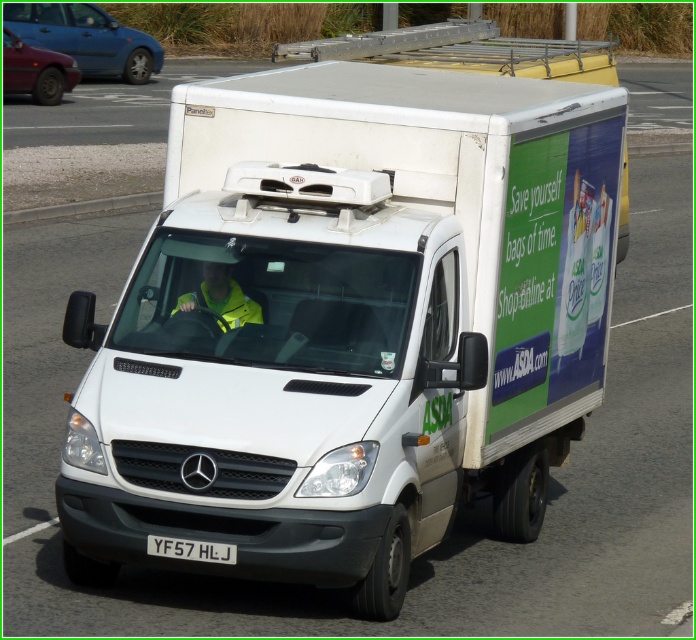
Can you confirm if metallic blue sedan at left is positioned to the right of yellow reflective jacket at center?

No, metallic blue sedan at left is not to the right of yellow reflective jacket at center.

Is point (40, 97) closer to viewer compared to point (258, 310)?

No.

Find the location of a particular element. The image size is (696, 640). metallic blue sedan at left is located at coordinates (35, 70).

Does blue metallic car at left have a greater width compared to yellow reflective jacket at center?

Yes, blue metallic car at left is wider than yellow reflective jacket at center.

Can you confirm if blue metallic car at left is thinner than yellow reflective jacket at center?

Incorrect, blue metallic car at left's width is not less than yellow reflective jacket at center's.

Where is `blue metallic car at left`? This screenshot has width=696, height=640. blue metallic car at left is located at coordinates (87, 38).

I want to click on blue metallic car at left, so click(x=87, y=38).

Can you confirm if metallic blue sedan at left is positioned above white plastic license plate at lower center?

Indeed, metallic blue sedan at left is positioned over white plastic license plate at lower center.

Between metallic blue sedan at left and white plastic license plate at lower center, which one has less height?

Standing shorter between the two is white plastic license plate at lower center.

You are a GUI agent. You are given a task and a screenshot of the screen. Output one action in this format:
    pyautogui.click(x=<x>, y=<y>)
    Task: Click on the metallic blue sedan at left
    The width and height of the screenshot is (696, 640).
    Given the screenshot: What is the action you would take?
    pyautogui.click(x=35, y=70)

In order to click on metallic blue sedan at left in this screenshot , I will do `click(35, 70)`.